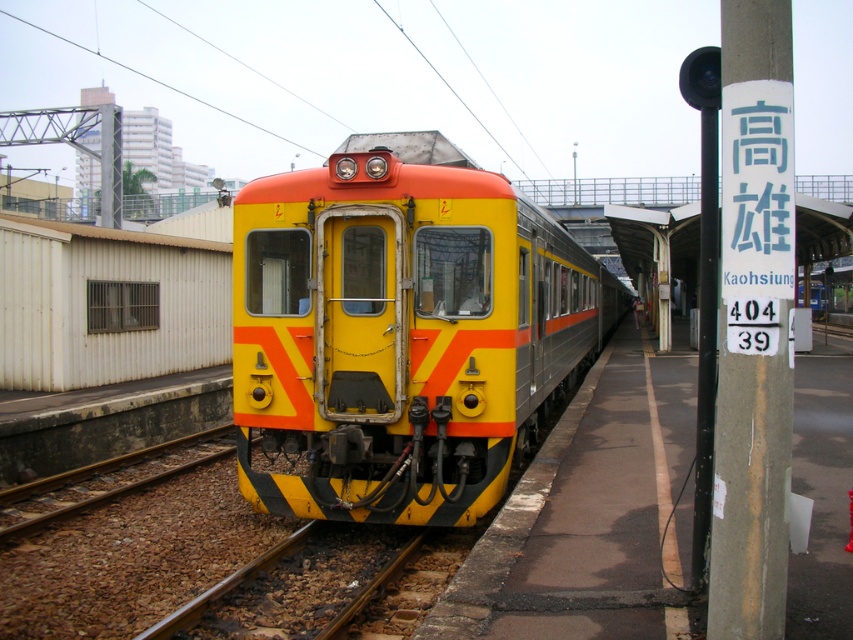
Question: Is yellow matte train at center smaller than brown gravel at lower left?

Choices:
 (A) no
 (B) yes

Answer: (A)

Question: Can you confirm if yellow matte train at center is positioned to the left of brown gravel at lower left?

Choices:
 (A) no
 (B) yes

Answer: (A)

Question: Which point appears farthest from the camera in this image?

Choices:
 (A) (289, 609)
 (B) (259, 211)

Answer: (B)

Question: Among these objects, which one is farthest from the camera?

Choices:
 (A) yellow matte train at center
 (B) brown gravel at lower left

Answer: (A)

Question: Considering the relative positions of yellow matte train at center and brown gravel at lower left in the image provided, where is yellow matte train at center located with respect to brown gravel at lower left?

Choices:
 (A) right
 (B) left

Answer: (A)